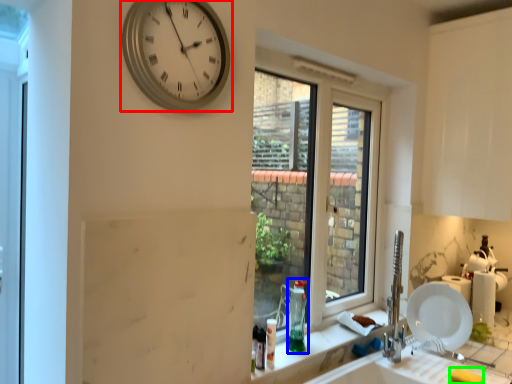
Question: Which object is the farthest from wall clock (highlighted by a red box)? Choose among these: bottle (highlighted by a blue box) or soap (highlighted by a green box).

Choices:
 (A) bottle
 (B) soap

Answer: (B)